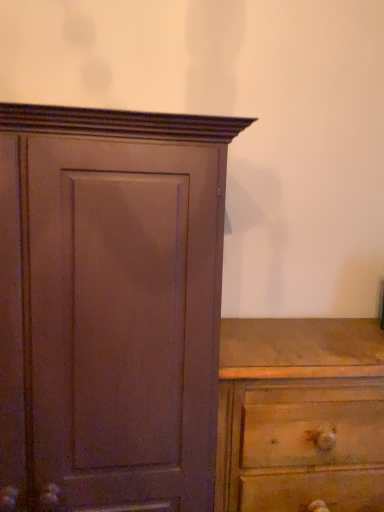
Question: Looking at their shapes, would you say wooden chest of drawers at lower right is wider or thinner than matte brown cupboard at left?

Choices:
 (A) thin
 (B) wide

Answer: (A)

Question: Based on their positions, is wooden chest of drawers at lower right located to the left or right of matte brown cupboard at left?

Choices:
 (A) left
 (B) right

Answer: (B)

Question: Does point click(x=248, y=509) appear closer or farther from the camera than point click(x=152, y=258)?

Choices:
 (A) farther
 (B) closer

Answer: (A)

Question: Is matte brown cupboard at left in front of or behind wooden chest of drawers at lower right in the image?

Choices:
 (A) behind
 (B) front

Answer: (B)

Question: Considering the positions of point (59, 349) and point (276, 430), is point (59, 349) closer or farther from the camera than point (276, 430)?

Choices:
 (A) farther
 (B) closer

Answer: (B)

Question: From the image's perspective, relative to wooden chest of drawers at lower right, is matte brown cupboard at left above or below?

Choices:
 (A) below
 (B) above

Answer: (B)

Question: In terms of width, does matte brown cupboard at left look wider or thinner when compared to wooden chest of drawers at lower right?

Choices:
 (A) wide
 (B) thin

Answer: (A)